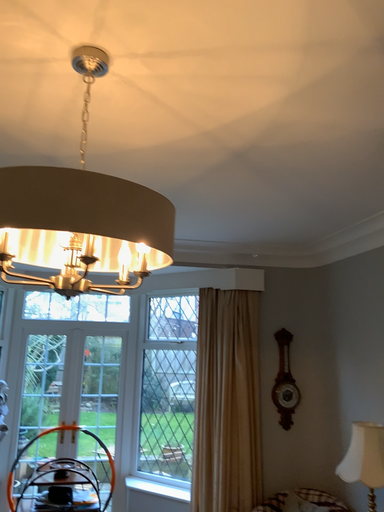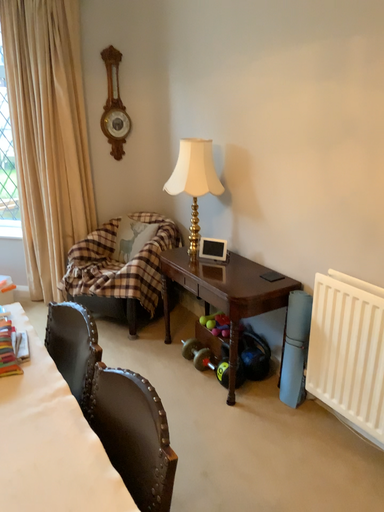
Question: How did the camera likely rotate when shooting the video?

Choices:
 (A) rotated right
 (B) rotated left

Answer: (A)